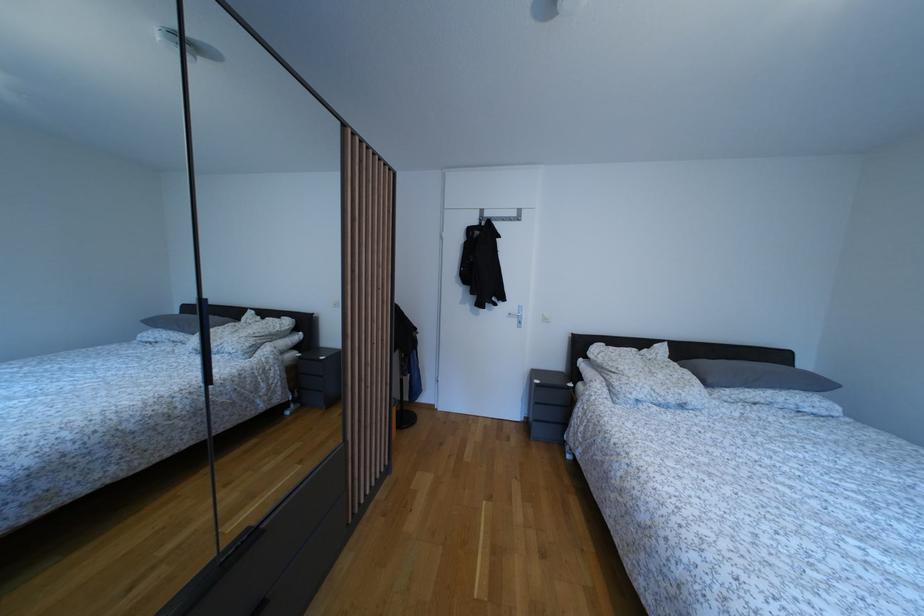
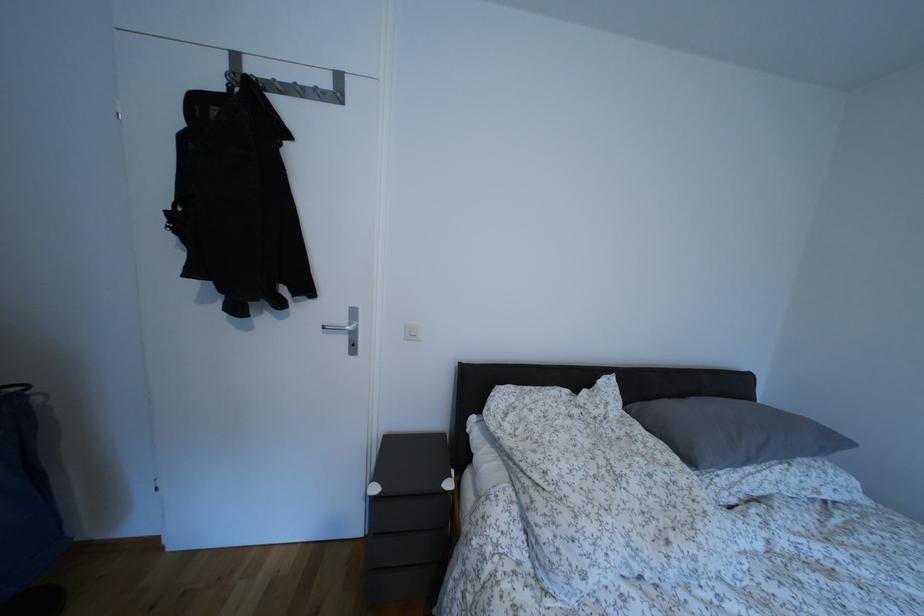
Based on the photo, the images are taken continuously from a first-person perspective. In which direction are you moving?

The movement direction of the cameraman is right, forward.